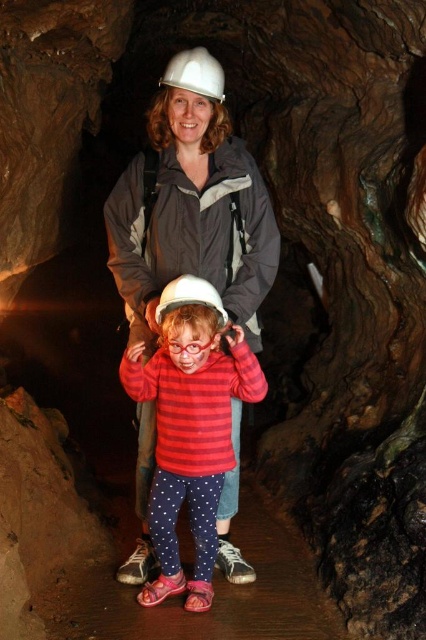
You are a safety inspector checking equipment in a cave. You notice two helmets at the center of the image. Which helmet has a larger width, the matte white helmet at center or the white matte helmet at center?

The matte white helmet at center has a larger width than the white matte helmet at center according to the description.

Where is the striped cotton shirt at center located in the image?

The striped cotton shirt at center is located at point (189, 424) in the image.